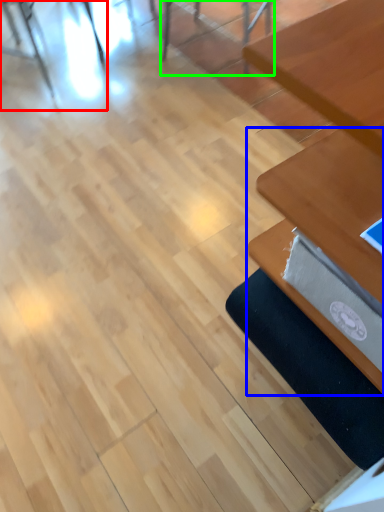
Question: Which is nearer to the chair (highlighted by a red box)? table (highlighted by a blue box) or chair (highlighted by a green box).

Choices:
 (A) table
 (B) chair

Answer: (B)